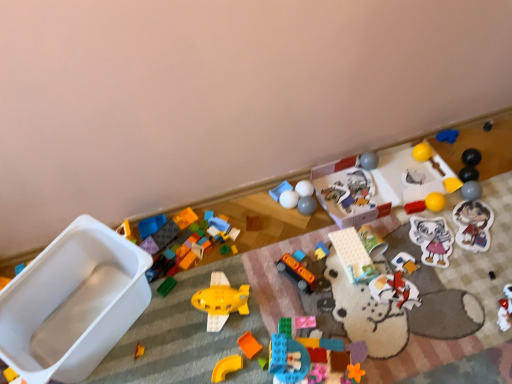
Locate an element on the screen. The height and width of the screenshot is (384, 512). vacant area that lies between white matte figure at center, placed as the seventh toy when sorted from right to left, and white plastic container at left, which is the 1th toy in left-to-right order is located at coordinates (251, 313).